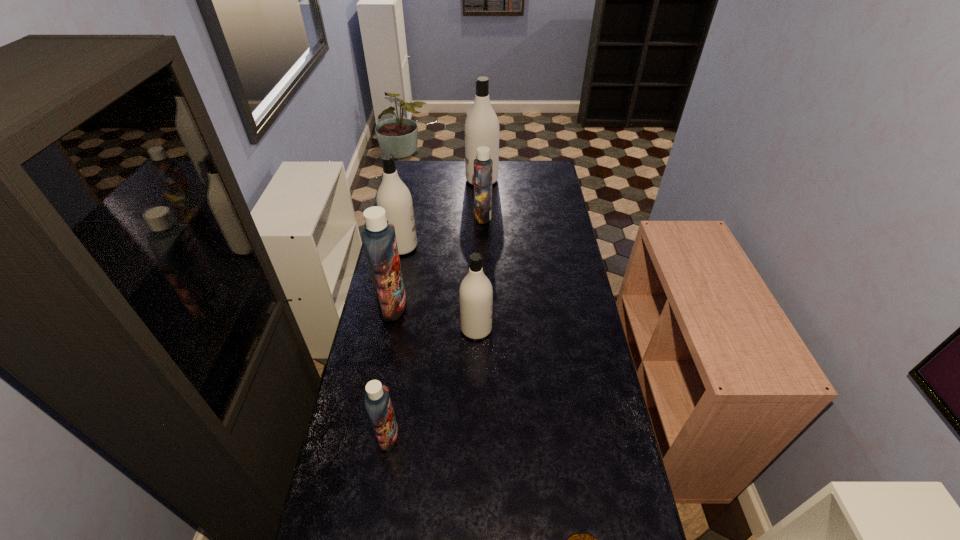
The width and height of the screenshot is (960, 540). Identify the location of the farthest object. (481, 128).

This screenshot has width=960, height=540. I want to click on the biggest white shampoo, so click(481, 128).

Find the location of a particular element. the fifth nearest object is located at coordinates (393, 195).

Where is `the second biggest white shampoo`? The width and height of the screenshot is (960, 540). the second biggest white shampoo is located at coordinates (393, 195).

The width and height of the screenshot is (960, 540). In order to click on the second nearest blue shampoo in this screenshot , I will do `click(379, 239)`.

This screenshot has width=960, height=540. Find the location of `the farthest blue shampoo`. the farthest blue shampoo is located at coordinates (483, 166).

The width and height of the screenshot is (960, 540). Identify the location of the second smallest blue shampoo. (483, 166).

The width and height of the screenshot is (960, 540). Identify the location of the nearest white shampoo. (476, 293).

What are the coordinates of `the sixth farthest object` in the screenshot? It's located at (377, 401).

I want to click on the smallest blue shampoo, so click(x=377, y=401).